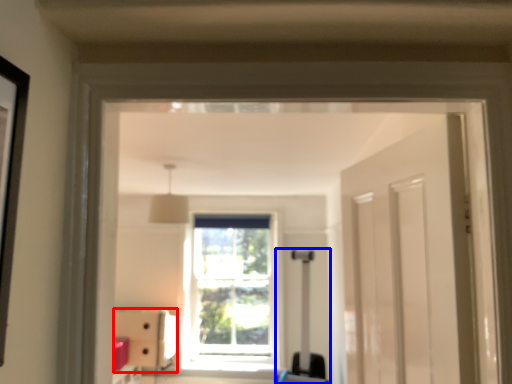
Question: Which object appears farthest to the camera in this image, furniture (highlighted by a red box) or luggage (highlighted by a blue box)?

Choices:
 (A) furniture
 (B) luggage

Answer: (A)